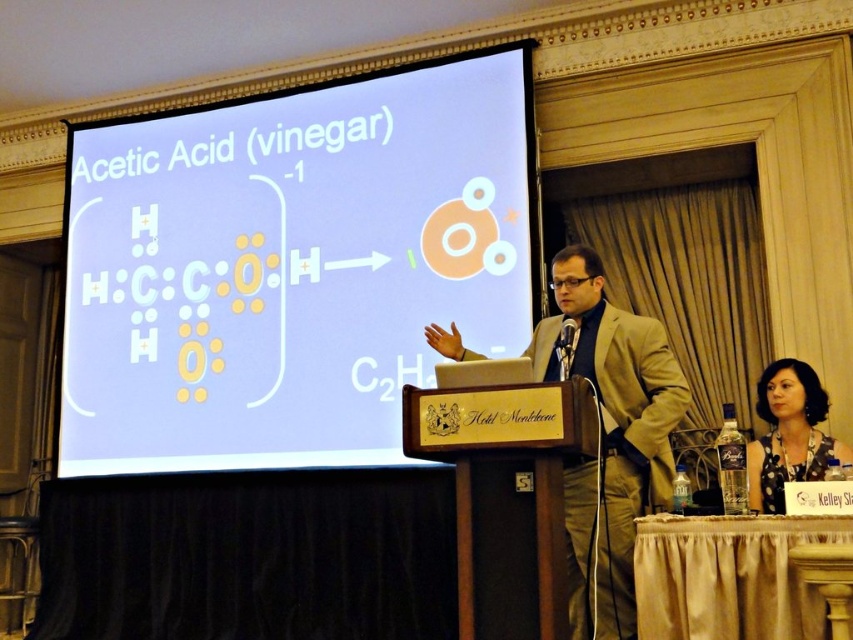
Question: Which point appears farthest from the camera in this image?

Choices:
 (A) (776, 452)
 (B) (431, 152)
 (C) (570, 636)

Answer: (B)

Question: Is white glossy projection screen at center to the right of beige suit at center from the viewer's perspective?

Choices:
 (A) no
 (B) yes

Answer: (A)

Question: Among these objects, which one is farthest from the camera?

Choices:
 (A) dark gray fabric at lower right
 (B) white glossy projection screen at center
 (C) beige suit at center

Answer: (B)

Question: Which object is farther from the camera taking this photo?

Choices:
 (A) white glossy projection screen at center
 (B) dark gray fabric at lower right
 (C) beige suit at center

Answer: (A)

Question: Is beige suit at center closer to the viewer compared to dark gray fabric at lower right?

Choices:
 (A) yes
 (B) no

Answer: (A)

Question: Does white glossy projection screen at center appear on the left side of beige suit at center?

Choices:
 (A) yes
 (B) no

Answer: (A)